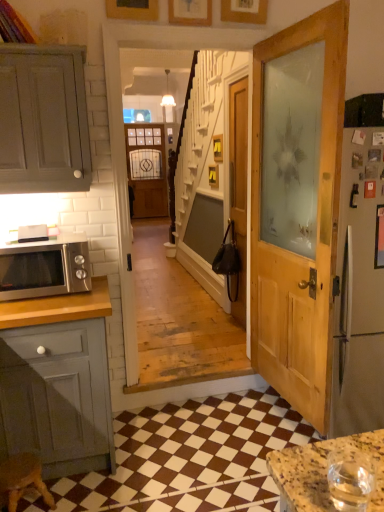
Find the location of a particular element. free space above brown checkered tile at lower center (from a real-world perspective) is located at coordinates (198, 448).